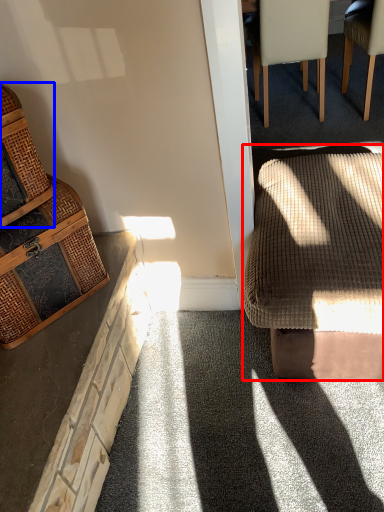
Question: Among these objects, which one is farthest to the camera, rocking chair (highlighted by a red box) or basket (highlighted by a blue box)?

Choices:
 (A) rocking chair
 (B) basket

Answer: (A)